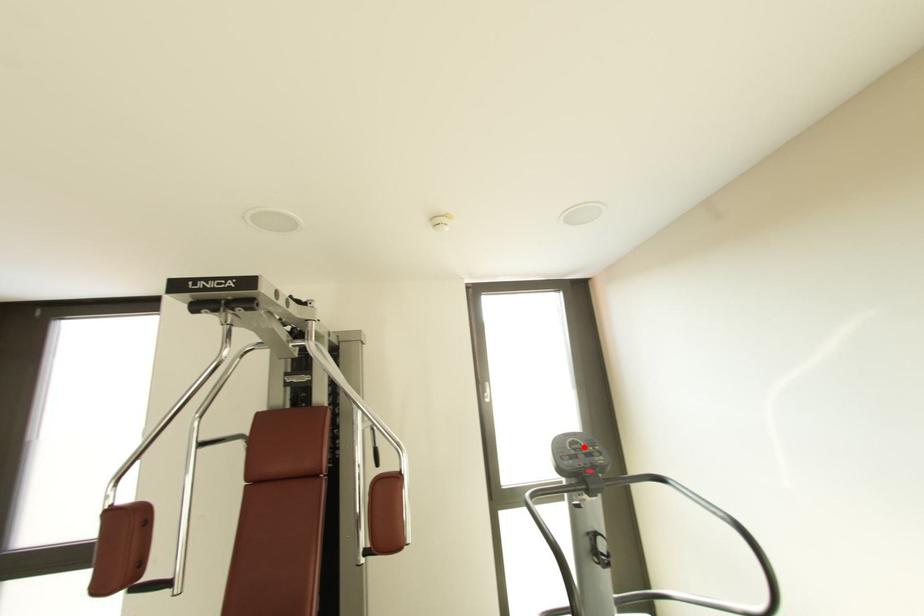
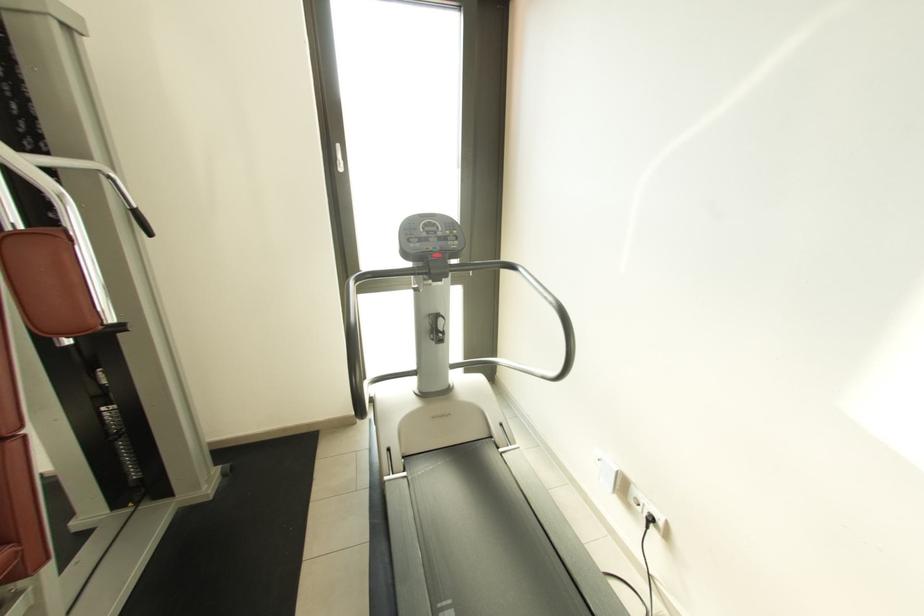
Find the pixel in the second image that matches the highlighted location in the first image.

(439, 230)